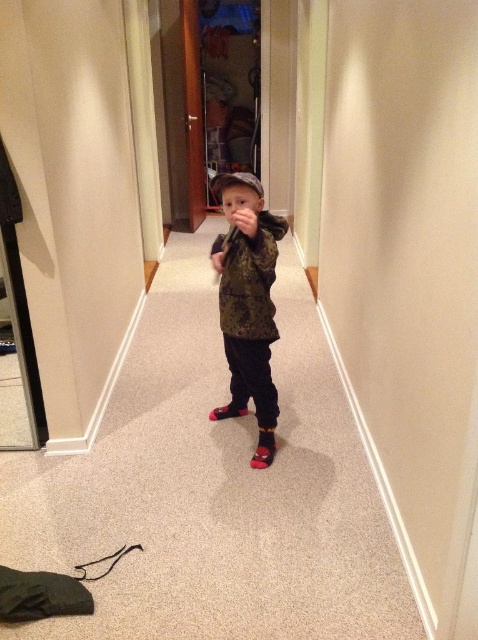
Who is positioned more to the left, camouflage jacket at center or red suede shoe at center?

From the viewer's perspective, camouflage jacket at center appears more on the left side.

Is point (242, 285) positioned after point (265, 456)?

No, (242, 285) is in front of (265, 456).

Who is more forward, (269, 381) or (262, 467)?

Point (262, 467)

Where is `camouflage jacket at center`? The width and height of the screenshot is (478, 640). camouflage jacket at center is located at coordinates (248, 291).

Who is taller, camouflage jacket at center or red fabric shoe at center?

With more height is camouflage jacket at center.

Does camouflage jacket at center appear under red fabric shoe at center?

No.

This screenshot has height=640, width=478. Identify the location of camouflage jacket at center. (248, 291).

Is point (270, 442) positioned behind point (245, 413)?

No, it is not.

Does red suede shoe at center have a greater width compared to red fabric shoe at center?

No, red suede shoe at center is not wider than red fabric shoe at center.

Which is in front, point (271, 445) or point (246, 412)?

Point (271, 445)

The image size is (478, 640). I want to click on red suede shoe at center, so click(x=263, y=449).